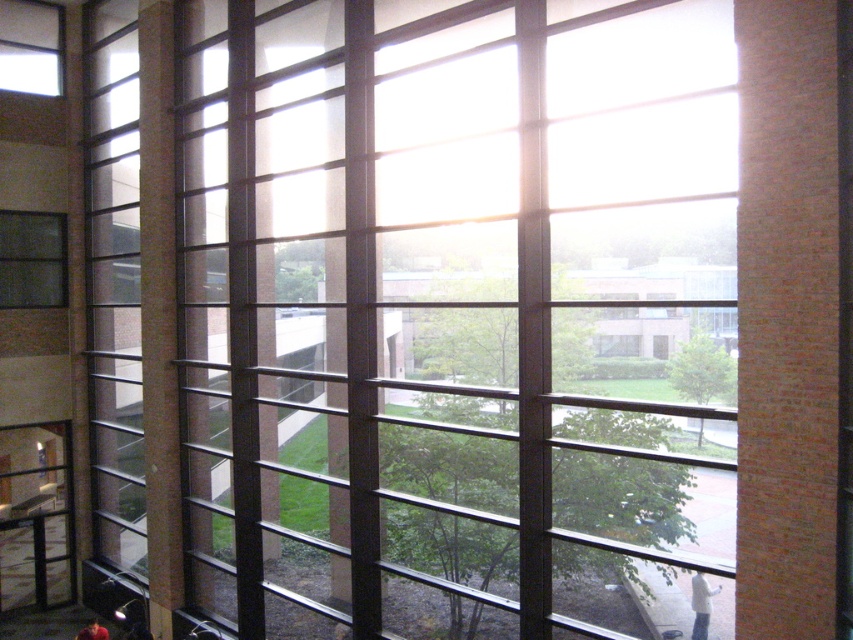
You are standing in the modern architectural interior space and want to look outside through the transparent glass window at center. Where exactly should you position yourself to ensure you are directly facing the window?

You should position yourself directly in front of the transparent glass window at center, which is located at coordinates point (457, 314), to face it directly.

You are an interior designer planning to place a large potted plant between the transparent glass window at center and the matte glass window at left. Based on their positions, which window should the plant be closer to?

The transparent glass window at center is positioned on the right side of the matte glass window at left, so the plant should be placed closer to the matte glass window at left to maintain symmetry between the two windows.

You are standing inside the building and want to look outside through the windows. Which window, the transparent glass window at center or the matte glass window at left, allows you to see the outdoor landscape more clearly?

The transparent glass window at center allows you to see the outdoor landscape more clearly because it is closer to the viewer than the matte glass window at left.